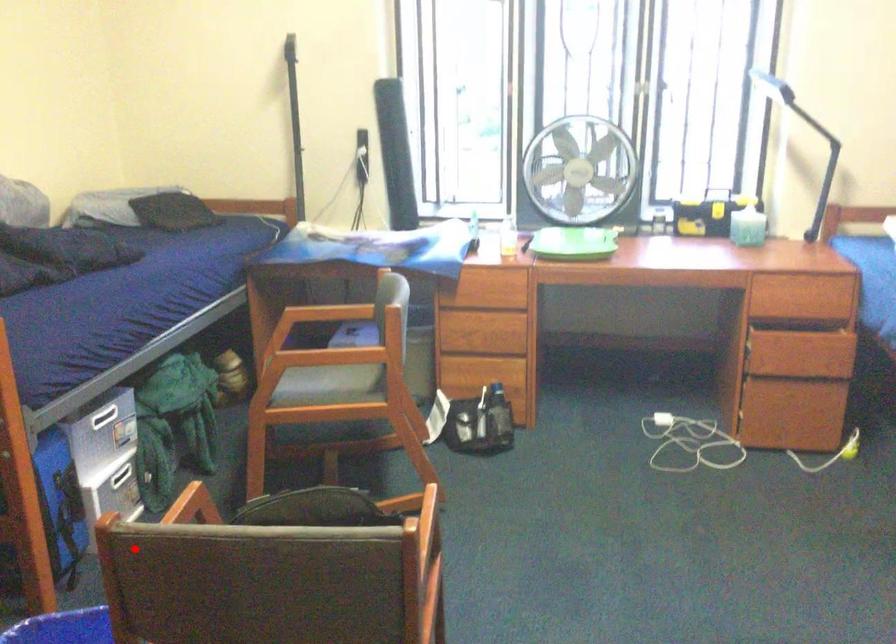
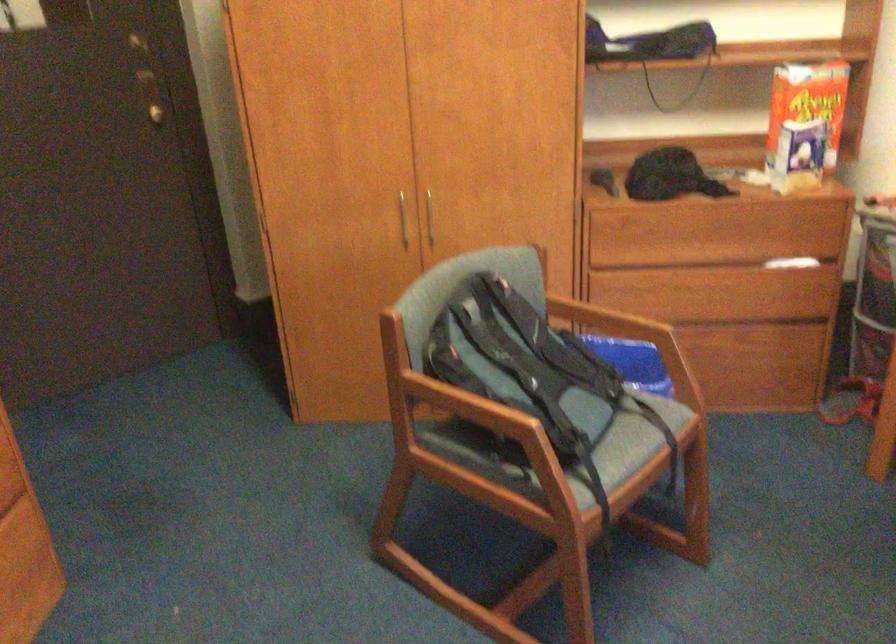
Find the pixel in the second image that matches the highlighted location in the first image.

(609, 325)